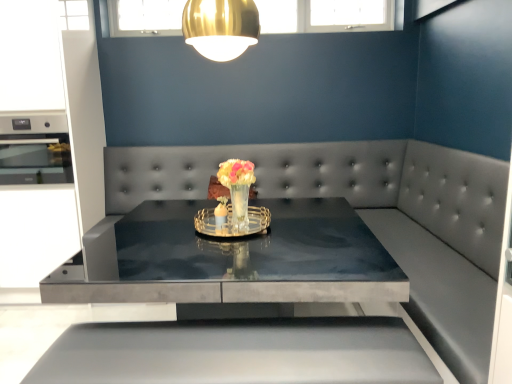
Question: Is matte black oven at left oriented towards translucent glass vase at center, which is the first floral arrangement from back to front?

Choices:
 (A) no
 (B) yes

Answer: (A)

Question: Can you confirm if matte black oven at left is thinner than translucent glass vase at center, which is the first floral arrangement from back to front?

Choices:
 (A) yes
 (B) no

Answer: (B)

Question: Considering the relative positions of matte black oven at left and translucent glass vase at center, positioned as the 2th floral arrangement in front-to-back order, in the image provided, is matte black oven at left to the right of translucent glass vase at center, positioned as the 2th floral arrangement in front-to-back order, from the viewer's perspective?

Choices:
 (A) yes
 (B) no

Answer: (B)

Question: Does matte black oven at left appear on the left side of translucent glass vase at center, positioned as the 2th floral arrangement in front-to-back order?

Choices:
 (A) yes
 (B) no

Answer: (A)

Question: From a real-world perspective, is matte black oven at left beneath translucent glass vase at center, positioned as the 2th floral arrangement in front-to-back order?

Choices:
 (A) no
 (B) yes

Answer: (A)

Question: Is matte black oven at left wider than translucent glass vase at center, which is the first floral arrangement from back to front?

Choices:
 (A) yes
 (B) no

Answer: (A)

Question: Are translucent glass vase at center, arranged as the 2th floral arrangement when viewed from the back, and smooth gray couch at center making contact?

Choices:
 (A) no
 (B) yes

Answer: (A)

Question: From the image's perspective, does translucent glass vase at center, arranged as the 2th floral arrangement when viewed from the back, appear lower than smooth gray couch at center?

Choices:
 (A) no
 (B) yes

Answer: (A)

Question: Can you confirm if translucent glass vase at center, arranged as the 2th floral arrangement when viewed from the back, is bigger than smooth gray couch at center?

Choices:
 (A) no
 (B) yes

Answer: (A)

Question: Considering the relative sizes of translucent glass vase at center, placed as the 1th floral arrangement when sorted from front to back, and smooth gray couch at center in the image provided, is translucent glass vase at center, placed as the 1th floral arrangement when sorted from front to back, wider than smooth gray couch at center?

Choices:
 (A) no
 (B) yes

Answer: (A)

Question: Can you confirm if translucent glass vase at center, arranged as the 2th floral arrangement when viewed from the back, is smaller than smooth gray couch at center?

Choices:
 (A) yes
 (B) no

Answer: (A)

Question: Is translucent glass vase at center, placed as the 1th floral arrangement when sorted from front to back, at the left side of smooth gray couch at center?

Choices:
 (A) no
 (B) yes

Answer: (B)

Question: Is translucent glass vase at center, arranged as the 2th floral arrangement when viewed from the back, behind gold metallic lampshade at upper center?

Choices:
 (A) no
 (B) yes

Answer: (B)